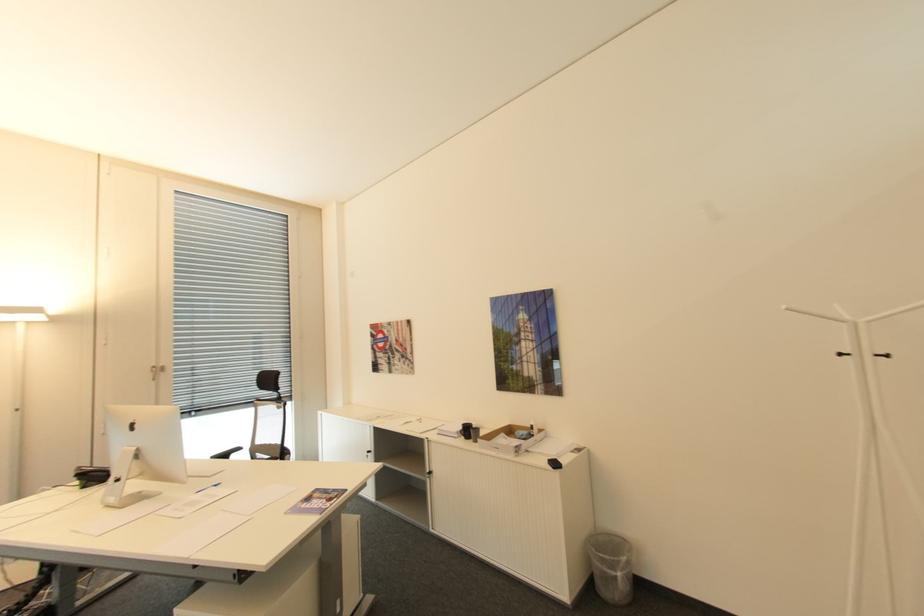
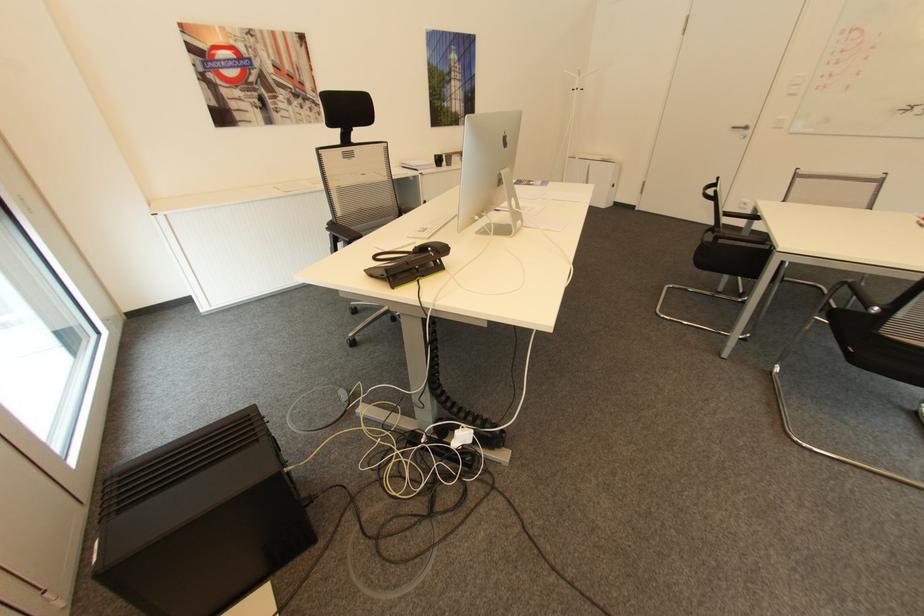
In the second image, find the point that corresponds to pixel 468 424 in the first image.

(441, 155)